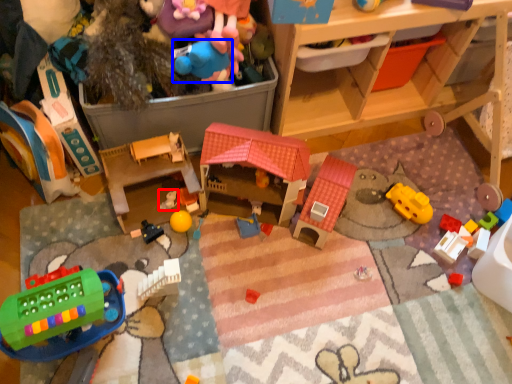
Question: Which object appears closest to the camera in this image, toy (highlighted by a red box) or toy (highlighted by a blue box)?

Choices:
 (A) toy
 (B) toy

Answer: (B)